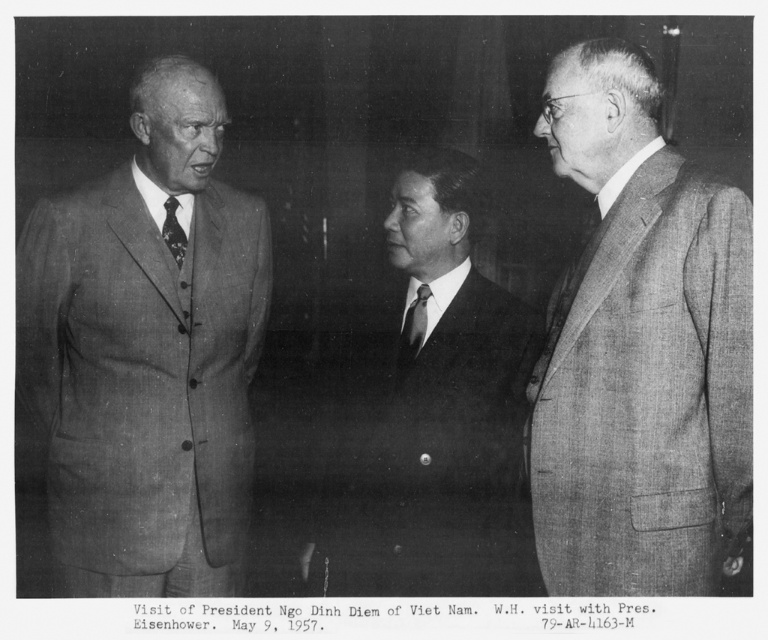
Based on the scene description, what is located at the coordinates point [452,340]?

The smooth black suit at center is located at point [452,340].

In the scene shown: You are standing in the room where the three men are conversing. There are two points marked in the image, one at coordinates point (x=121, y=380) and another at point (x=406, y=314). Which of these points is nearer to you?

Point (x=121, y=380) is closer to the viewer than point (x=406, y=314).